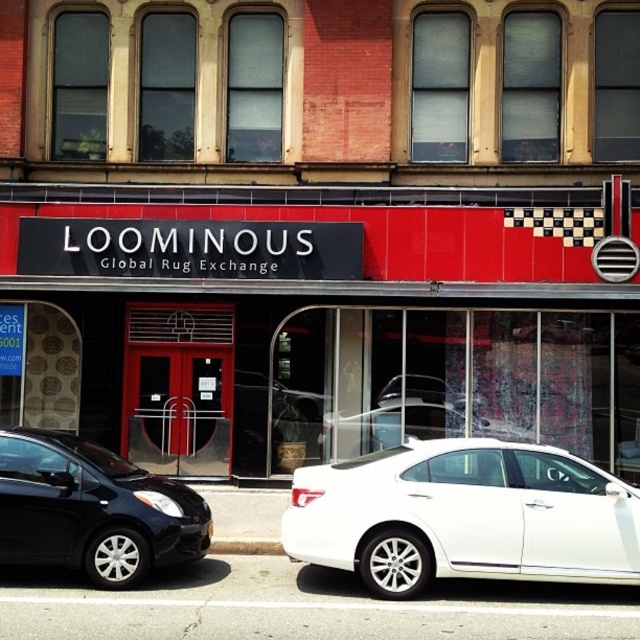
Measure the distance between red glossy sign at center and shiny black sedan at lower left.

A distance of 5.63 meters exists between red glossy sign at center and shiny black sedan at lower left.

Identify the location of red glossy sign at center. Image resolution: width=640 pixels, height=640 pixels. (321, 320).

Which is in front, point (29, 410) or point (205, 524)?

Positioned in front is point (205, 524).

Where is `red glossy sign at center`? red glossy sign at center is located at coordinates (321, 320).

Who is shorter, white metallic sedan at center or shiny black sedan at lower left?

With less height is white metallic sedan at center.

Is point (552, 536) positioned in front of point (45, 561)?

Yes.

Is point (556, 497) closer to viewer compared to point (20, 440)?

Yes, it is.

You are a GUI agent. You are given a task and a screenshot of the screen. Output one action in this format:
    pyautogui.click(x=<x>, y=<y>)
    Task: Click on the white metallic sedan at center
    
    Given the screenshot: What is the action you would take?
    [x=464, y=515]

Between red glossy sign at center and white metallic sedan at center, which one is positioned higher?

red glossy sign at center is higher up.

Locate an element on the screen. red glossy sign at center is located at coordinates (321, 320).

The image size is (640, 640). In order to click on red glossy sign at center in this screenshot , I will do (x=321, y=320).